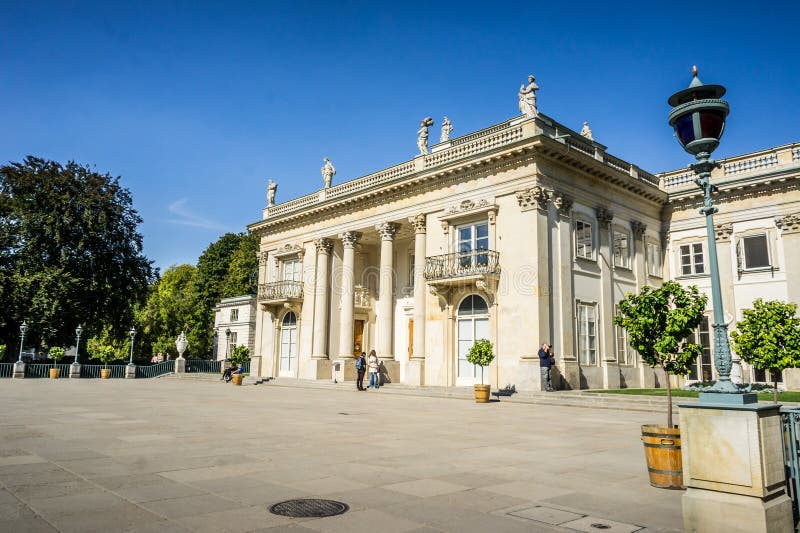
Image resolution: width=800 pixels, height=533 pixels. Identify the location of columns. (350, 294), (322, 277), (386, 289).